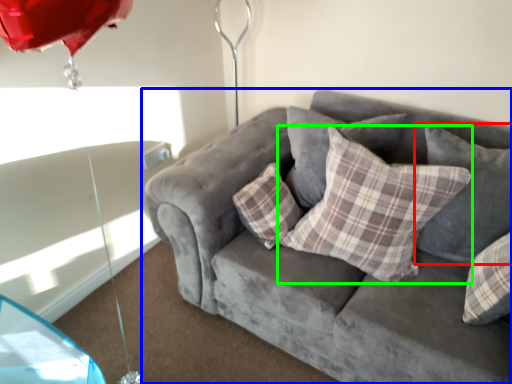
Question: Which is nearer to the pillow (highlighted by a red box)? studio couch (highlighted by a blue box) or pillow (highlighted by a green box).

Choices:
 (A) studio couch
 (B) pillow

Answer: (B)